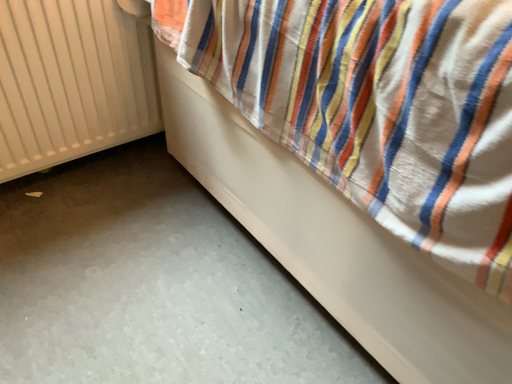
The height and width of the screenshot is (384, 512). Describe the element at coordinates (365, 162) in the screenshot. I see `white smooth bed at lower right` at that location.

The height and width of the screenshot is (384, 512). Find the location of `white smooth bed at lower right`. white smooth bed at lower right is located at coordinates (365, 162).

Measure the distance between white smooth bed at lower right and camera.

17.42 inches.

What is the approximate width of white matte radiator at left?

4.14 inches.

At what (x,y) coordinates should I click in order to perform the action: click on white matte radiator at left. Please return your answer as a coordinate pair (x, y). Looking at the image, I should click on (71, 82).

What do you see at coordinates (71, 82) in the screenshot?
I see `white matte radiator at left` at bounding box center [71, 82].

You are a GUI agent. You are given a task and a screenshot of the screen. Output one action in this format:
    pyautogui.click(x=<x>, y=<y>)
    Task: Click on the white smooth bed at lower right
    This screenshot has width=512, height=384.
    Given the screenshot: What is the action you would take?
    pyautogui.click(x=365, y=162)

Considering the relative positions of white matte radiator at left and white smooth bed at lower right in the image provided, is white matte radiator at left to the right of white smooth bed at lower right from the viewer's perspective?

In fact, white matte radiator at left is to the left of white smooth bed at lower right.

Which is in front, white matte radiator at left or white smooth bed at lower right?

white smooth bed at lower right is in front.

Which is more distant, [118,60] or [507,215]?

The point [118,60] is farther from the camera.

From the image's perspective, does white matte radiator at left appear lower than white smooth bed at lower right?

Yes.

From a real-world perspective, who is located higher, white matte radiator at left or white smooth bed at lower right?

From a 3D spatial view, white smooth bed at lower right is above.

Between white matte radiator at left and white smooth bed at lower right, which one has larger width?

With larger width is white smooth bed at lower right.

Is white matte radiator at left shorter than white smooth bed at lower right?

Correct, white matte radiator at left is not as tall as white smooth bed at lower right.

Is white matte radiator at left smaller than white smooth bed at lower right?

Yes, white matte radiator at left is smaller than white smooth bed at lower right.

Do you think white matte radiator at left is within white smooth bed at lower right, or outside of it?

The correct answer is: outside.

Would you consider white matte radiator at left to be distant from white smooth bed at lower right?

No, white matte radiator at left is not far from white smooth bed at lower right.

Is white matte radiator at left oriented towards white smooth bed at lower right?

No.

What's the angular difference between white matte radiator at left and white smooth bed at lower right's facing directions?

89.4 degrees.

Measure the distance from white matte radiator at left to white smooth bed at lower right.

55.82 centimeters.

The width and height of the screenshot is (512, 384). In order to click on furniture located in front of the white matte radiator at left in this screenshot , I will do `click(365, 162)`.

Between white smooth bed at lower right and white matte radiator at left, which one appears on the right side from the viewer's perspective?

white smooth bed at lower right is more to the right.

Considering the positions of objects white smooth bed at lower right and white matte radiator at left in the image provided, who is behind, white smooth bed at lower right or white matte radiator at left?

white matte radiator at left is more distant.

Is point (290, 262) closer or farther from the camera than point (88, 122)?

Point (290, 262) appears to be closer to the viewer than point (88, 122).

From the image's perspective, which one is positioned lower, white smooth bed at lower right or white matte radiator at left?

From the image's view, white matte radiator at left is below.

From a real-world perspective, is white smooth bed at lower right on top of white matte radiator at left?

Indeed, from a real-world perspective, white smooth bed at lower right stands above white matte radiator at left.

Between white smooth bed at lower right and white matte radiator at left, which one has smaller width?

white matte radiator at left is thinner.

Does white smooth bed at lower right have a greater height compared to white matte radiator at left?

Yes, white smooth bed at lower right is taller than white matte radiator at left.

Does white smooth bed at lower right have a smaller size compared to white matte radiator at left?

No.

Is white smooth bed at lower right not inside white matte radiator at left?

Indeed, white smooth bed at lower right is completely outside white matte radiator at left.

Would you say white smooth bed at lower right is a long distance from white matte radiator at left?

That's not correct — white smooth bed at lower right is a little close to white matte radiator at left.

Could you tell me if white smooth bed at lower right is turned towards white matte radiator at left?

Yes.

What's the angular difference between white smooth bed at lower right and white matte radiator at left's facing directions?

white smooth bed at lower right and white matte radiator at left are facing 89.4 degrees away from each other.

Looking at this image, measure the distance between white smooth bed at lower right and white matte radiator at left.

A distance of 21.97 inches exists between white smooth bed at lower right and white matte radiator at left.

Locate an element on the screen. radiator on the left of white smooth bed at lower right is located at coordinates (71, 82).

Identify the location of radiator on the left of white smooth bed at lower right. (71, 82).

Image resolution: width=512 pixels, height=384 pixels. What are the coordinates of `furniture on the right of white matte radiator at left` in the screenshot? It's located at (365, 162).